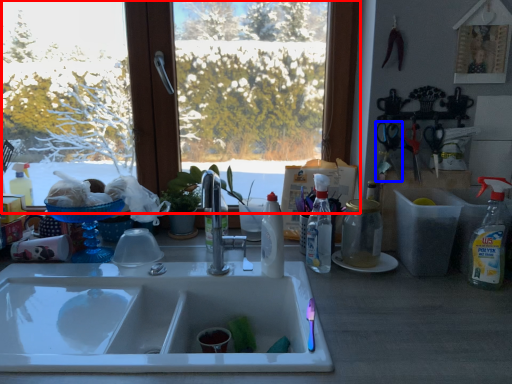
Question: Which object is closer to the camera taking this photo, window (highlighted by a red box) or scissors (highlighted by a blue box)?

Choices:
 (A) window
 (B) scissors

Answer: (B)